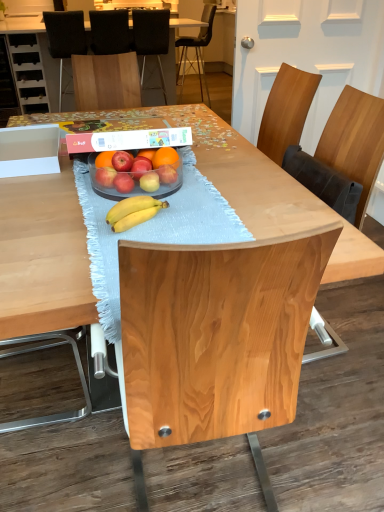
Measure the distance between point (133, 194) and camera.

4.06 feet.

Measure the distance between point (104, 39) and camera.

A distance of 4.10 meters exists between point (104, 39) and camera.

Locate an element on the screen. wooden table at center is located at coordinates (22, 24).

The width and height of the screenshot is (384, 512). Identify the location of light blue textured tablecloth at center. (152, 231).

Image resolution: width=384 pixels, height=512 pixels. I want to click on smooth orange grapefruit at center, so click(x=136, y=173).

Is there a large distance between smooth orange grapefruit at center and black leather chair at upper center, the fifth chair positioned from the front?

Indeed, smooth orange grapefruit at center is not near black leather chair at upper center, the fifth chair positioned from the front.

I want to click on grapefruit on the left of the black leather chair at upper center, the fifth chair positioned from the front, so click(136, 173).

Which is more to the right, smooth orange grapefruit at center or black leather chair at upper center, acting as the first chair starting from the back?

Positioned to the right is black leather chair at upper center, acting as the first chair starting from the back.

Is point (188, 46) less distant than point (125, 187)?

No, (188, 46) is behind (125, 187).

Does black leather chair at upper center, the fifth chair positioned from the front, lie behind matte red apple at center, which is the 3th apple from left to right?

Yes, black leather chair at upper center, the fifth chair positioned from the front, is further from the camera.

From the image's perspective, starting from the matte red apple at center, which is the 3th apple from left to right, which chair is the 4th one above? Please provide its 2D coordinates.

[(197, 46)]

Is black leather chair at upper center, the fifth chair positioned from the front, completely or partially outside of matte red apple at center, which is the 3th apple from left to right?

Yes.

Consider the image. Does light blue textured tablecloth at center turn towards matte red apple at center, acting as the 1th apple starting from the left?

No, light blue textured tablecloth at center does not turn towards matte red apple at center, acting as the 1th apple starting from the left.

Is point (191, 195) positioned after point (106, 179)?

Yes.

Is light blue textured tablecloth at center touching matte red apple at center, the 6th apple when ordered from right to left?

light blue textured tablecloth at center and matte red apple at center, the 6th apple when ordered from right to left, are clearly separated.

Is the surface of matte red apple at center, the 6th apple when ordered from right to left, in direct contact with black fabric chair at center, which ranks as the 2th chair in back-to-front order?

No, matte red apple at center, the 6th apple when ordered from right to left, is not with black fabric chair at center, which ranks as the 2th chair in back-to-front order.

Between point (95, 178) and point (147, 53), which one is positioned behind?

The point (147, 53) is farther from the camera.

Is matte red apple at center, the 6th apple when ordered from right to left, closer to the viewer compared to black fabric chair at center, acting as the 4th chair starting from the front?

Yes, it is.

From the image's perspective, does wooden table at center appear lower than orangesmoothfruit at center?

No, from the image's perspective, wooden table at center is not beneath orangesmoothfruit at center.

Is wooden table at center not inside orangesmoothfruit at center?

Indeed, wooden table at center is completely outside orangesmoothfruit at center.

At what (x,y) coordinates should I click in order to perform the action: click on orange above the wooden table at center (from a real-world perspective). Please return your answer as a coordinate pair (x, y). The width and height of the screenshot is (384, 512). Looking at the image, I should click on (165, 157).

Is orangesmoothfruit at center bigger than matte red apple at center, which is the 3th apple from left to right?

Yes.

How many degrees apart are the facing directions of orangesmoothfruit at center and matte red apple at center, the fourth apple when ordered from right to left?

The angular difference between orangesmoothfruit at center and matte red apple at center, the fourth apple when ordered from right to left, is 2.56 degrees.

Are orangesmoothfruit at center and matte red apple at center, which is the 3th apple from left to right, making contact?

No, orangesmoothfruit at center is not beside matte red apple at center, which is the 3th apple from left to right.

From their relative heights in the image, would you say orangesmoothfruit at center is taller or shorter than matte red apple at center, the fourth apple when ordered from right to left?

Considering their sizes, orangesmoothfruit at center has more height than matte red apple at center, the fourth apple when ordered from right to left.

Would you say red matte apple at center, the third apple in the right-to-left sequence, is part of black fabric chair at upper center, which appears as the 3th chair when viewed from the front,'s contents?

No.

Who is shorter, black fabric chair at upper center, which appears as the 3th chair when viewed from the back, or red matte apple at center, the third apple in the right-to-left sequence?

A: Standing shorter between the two is red matte apple at center, the third apple in the right-to-left sequence.

Is black fabric chair at upper center, which appears as the 3th chair when viewed from the front, bigger or smaller than red matte apple at center, the third apple in the right-to-left sequence?

In the image, black fabric chair at upper center, which appears as the 3th chair when viewed from the front, appears to be larger than red matte apple at center, the third apple in the right-to-left sequence.

Which object is positioned more to the right, black fabric chair at upper center, which appears as the 3th chair when viewed from the back, or red matte apple at center, the third apple in the right-to-left sequence?

red matte apple at center, the third apple in the right-to-left sequence.

You are a GUI agent. You are given a task and a screenshot of the screen. Output one action in this format:
    pyautogui.click(x=<x>, y=<y>)
    Task: Click on the 3rd chair located beneath the smooth orange grapefruit at center (from a real-world perspective)
    This screenshot has width=384, height=512.
    Given the screenshot: What is the action you would take?
    pyautogui.click(x=197, y=46)

Starting from the matte red apple at center, which is the 3th apple from left to right, which chair is the 4th one behind? Please provide its 2D coordinates.

[(197, 46)]

Which object lies nearer to the anchor point smooth orange grapefruit at center, matte red apple at center, which appears as the first apple when viewed from the right, or black fabric chair at upper center, which appears as the 3th chair when viewed from the front?

The object closer to smooth orange grapefruit at center is matte red apple at center, which appears as the first apple when viewed from the right.

Estimate the real-world distances between objects in this image. Which object is closer to light blue textured tablecloth at center, matte red apple at center, the fourth apple when ordered from right to left, or matte red apple at center, placed as the 6th apple when sorted from left to right?

Based on the image, matte red apple at center, the fourth apple when ordered from right to left, appears to be nearer to light blue textured tablecloth at center.

Based on their spatial positions, is natural wood chair at center, the 1th chair from the front, or matte red apple at center, which is the 3th apple from left to right, closer to matte red apple at center, the 6th apple when ordered from right to left?

matte red apple at center, which is the 3th apple from left to right, lies closer to matte red apple at center, the 6th apple when ordered from right to left, than the other object.

Estimate the real-world distances between objects in this image. Which object is further from black fabric chair at upper center, which appears as the 3th chair when viewed from the front, black fabric chair at center, acting as the 4th chair starting from the front, or matte red apple at center, the 5th apple viewed from the left?

matte red apple at center, the 5th apple viewed from the left, is further to black fabric chair at upper center, which appears as the 3th chair when viewed from the front.

Considering their positions, is natural wood chair at center, the 1th chair from the front, positioned further to orangesmoothfruit at center than matte red apple at center, which appears as the first apple when viewed from the right?

natural wood chair at center, the 1th chair from the front, is further to orangesmoothfruit at center.

In the scene shown: Considering their positions, is orangesmoothfruit at center positioned further to red matte apple at center, the third apple in the right-to-left sequence, than matte red apple at center, acting as the 1th apple starting from the left?

matte red apple at center, acting as the 1th apple starting from the left, lies further to red matte apple at center, the third apple in the right-to-left sequence, than the other object.

From the image, which object appears to be nearer to matte red apple at center, placed as the 6th apple when sorted from left to right, wooden table at center or black leather chair at upper center, the fifth chair positioned from the front?

wooden table at center.

Based on their spatial positions, is matte red apple at center, which appears as the first apple when viewed from the right, or red matte apple at center, which is the fourth apple from left to right, closer to black fabric chair at center, which ranks as the 2th chair in back-to-front order?

red matte apple at center, which is the fourth apple from left to right.

Identify the location of grapefruit located between natural wood chair at center, marked as the 5th chair in a back-to-front arrangement, and matte red apple at center, the 6th apple when ordered from right to left, in the depth direction. The height and width of the screenshot is (512, 384). (136, 173).

This screenshot has height=512, width=384. What are the coordinates of `grapefruit located between light blue textured tablecloth at center and matte red apple at center, which is the 3th apple from left to right, in the depth direction` in the screenshot? It's located at (136, 173).

You are a GUI agent. You are given a task and a screenshot of the screen. Output one action in this format:
    pyautogui.click(x=<x>, y=<y>)
    Task: Click on the grapefruit located between light blue textured tablecloth at center and orangesmoothfruit at center in the depth direction
    Image resolution: width=384 pixels, height=512 pixels.
    Given the screenshot: What is the action you would take?
    click(x=136, y=173)

Where is `apple between red matte apple at center, the third apple in the right-to-left sequence, and black fabric chair at upper center, which appears as the 3th chair when viewed from the back, from front to back`? This screenshot has width=384, height=512. apple between red matte apple at center, the third apple in the right-to-left sequence, and black fabric chair at upper center, which appears as the 3th chair when viewed from the back, from front to back is located at coordinates (167, 174).